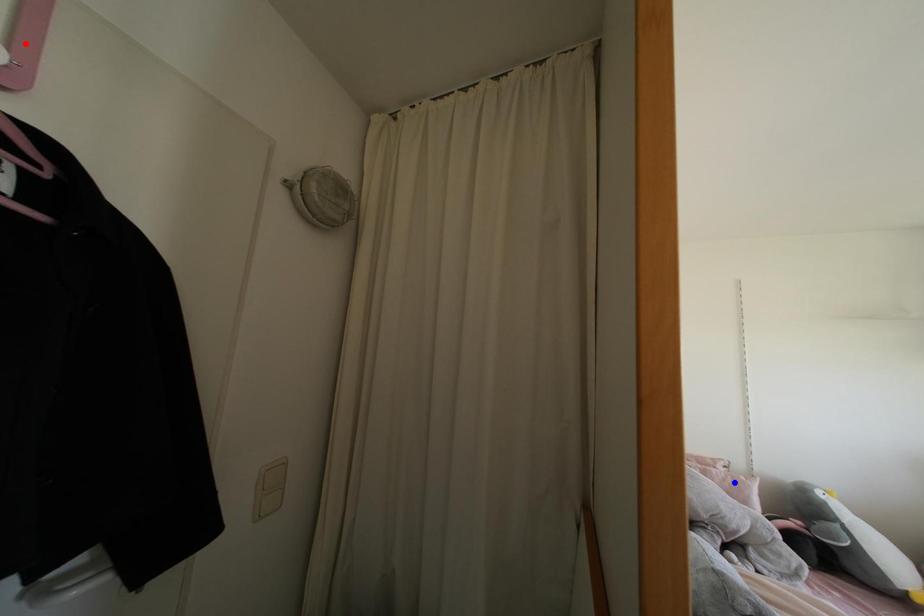
Question: In the image, two points are highlighted. Which point is nearer to the camera? Reply with the corresponding letter.

Choices:
 (A) blue point
 (B) red point

Answer: (B)